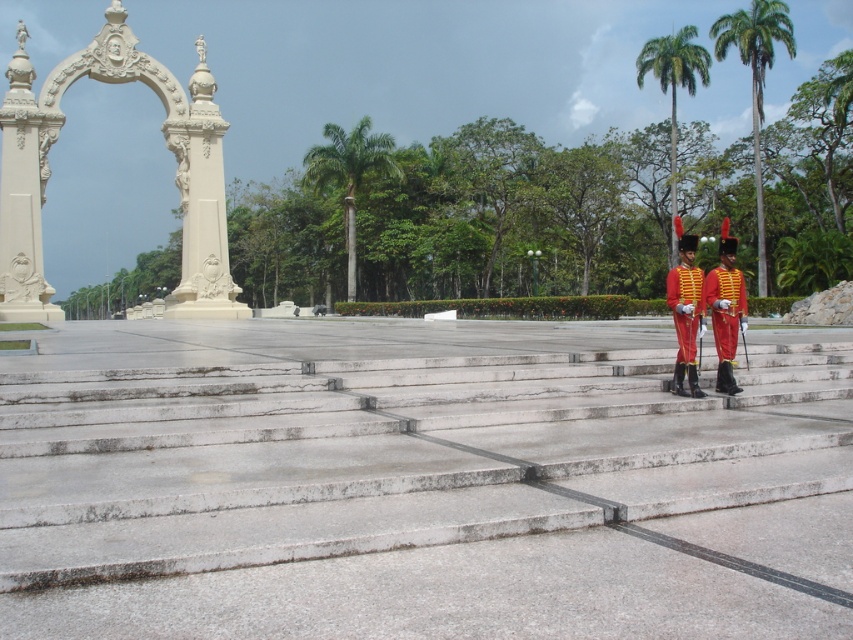
Is smooth concrete stairs at center positioned in front of green leafy palm tree at upper right?

Yes, smooth concrete stairs at center is closer to the viewer.

The width and height of the screenshot is (853, 640). Describe the element at coordinates (390, 454) in the screenshot. I see `smooth concrete stairs at center` at that location.

Locate an element on the screen. smooth concrete stairs at center is located at coordinates (390, 454).

Identify the location of smooth concrete stairs at center. (390, 454).

Can you confirm if smooth concrete stairs at center is bigger than shiny red fabric uniform at center?

Actually, smooth concrete stairs at center might be smaller than shiny red fabric uniform at center.

Where is `smooth concrete stairs at center`? The height and width of the screenshot is (640, 853). smooth concrete stairs at center is located at coordinates (390, 454).

Between white stone arch at upper left and green leafy palm tree at center, which one is positioned lower?

Positioned lower is white stone arch at upper left.

Is white stone arch at upper left above green leafy palm tree at center?

Incorrect, white stone arch at upper left is not positioned above green leafy palm tree at center.

Is point (26, 317) closer to viewer compared to point (355, 154)?

That is True.

You are a GUI agent. You are given a task and a screenshot of the screen. Output one action in this format:
    pyautogui.click(x=<x>, y=<y>)
    Task: Click on the white stone arch at upper left
    The width and height of the screenshot is (853, 640).
    Given the screenshot: What is the action you would take?
    pyautogui.click(x=166, y=145)